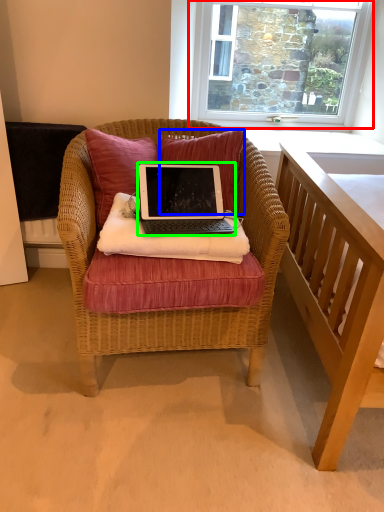
Question: Which object is positioned farthest from window (highlighted by a red box)? Select from pillow (highlighted by a blue box) and laptop (highlighted by a green box).

Choices:
 (A) pillow
 (B) laptop

Answer: (B)